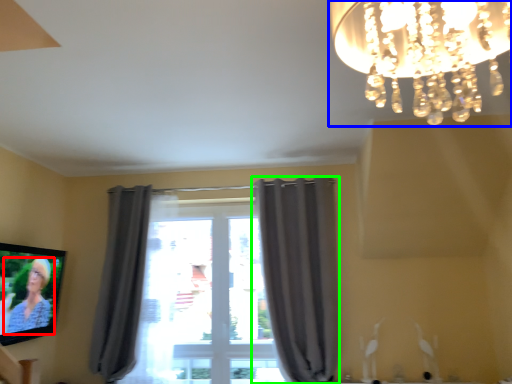
Question: Considering the real-world distances, which object is farthest from person (highlighted by a red box)? lamp (highlighted by a blue box) or curtain (highlighted by a green box)?

Choices:
 (A) lamp
 (B) curtain

Answer: (A)